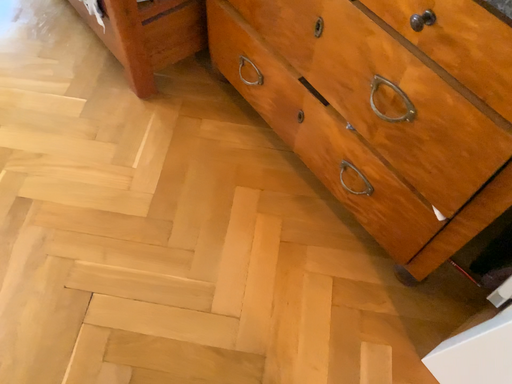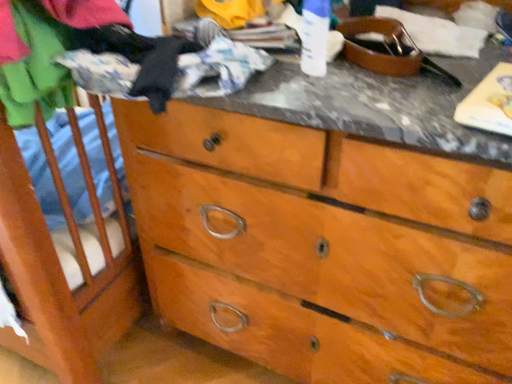
Question: How did the camera likely rotate when shooting the video?

Choices:
 (A) rotated right
 (B) rotated left

Answer: (A)